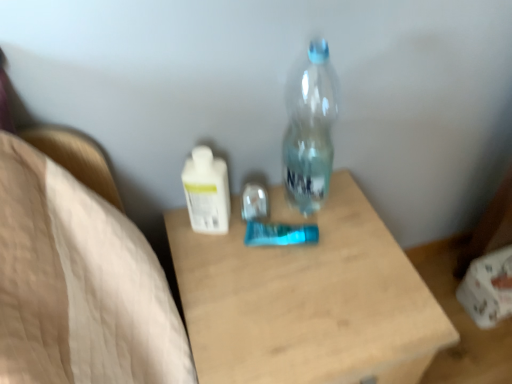
Where is `free region on the left part of transparent plastic bottle at center, which appears as the 2th bottle when viewed from the left`? This screenshot has width=512, height=384. free region on the left part of transparent plastic bottle at center, which appears as the 2th bottle when viewed from the left is located at coordinates (229, 228).